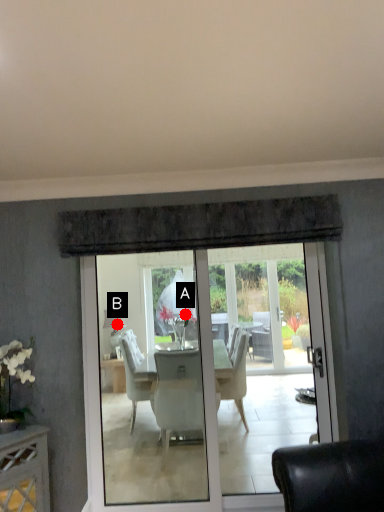
Question: Two points are circled on the image, labeled by A and B beside each circle. Which point is closer to the camera?

Choices:
 (A) A is closer
 (B) B is closer

Answer: (A)